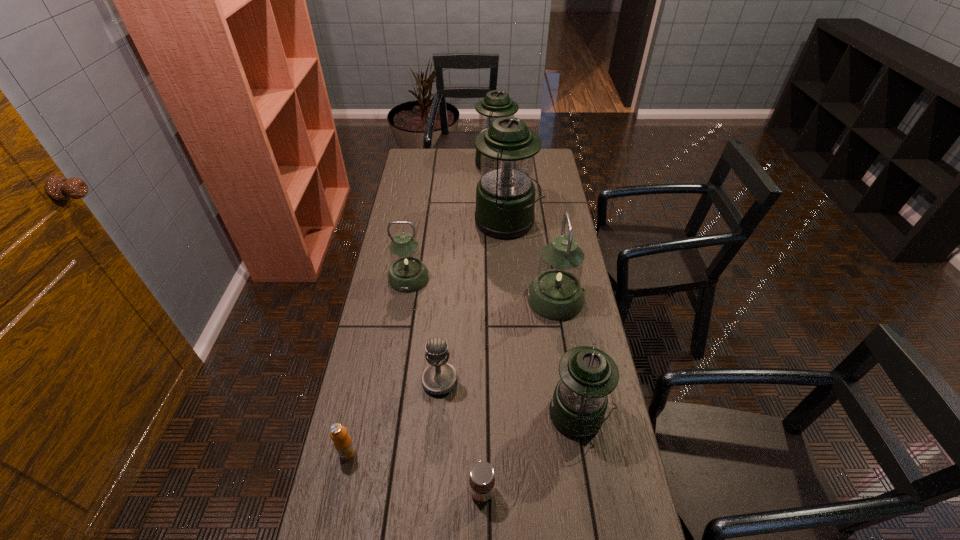
Locate an element on the screen. microphone is located at coordinates (438, 378).

At what (x,y) coordinates should I click in order to perform the action: click on the second shortest object. Please return your answer as a coordinate pair (x, y). Image resolution: width=960 pixels, height=540 pixels. Looking at the image, I should click on (343, 443).

Find the location of `the second nearest object`. the second nearest object is located at coordinates point(343,443).

Where is `the shortest object`? the shortest object is located at coordinates (481, 480).

Image resolution: width=960 pixels, height=540 pixels. I want to click on jam, so click(481, 480).

At what (x,y) coordinates should I click in order to perform the action: click on free space located 0.090m on the left of the tallest object. Please return your answer as a coordinate pair (x, y). Looking at the image, I should click on (454, 222).

Identify the location of vacant region located 0.070m on the right of the farthest object. (534, 165).

The image size is (960, 540). I want to click on vacant area situated 0.140m on the back of the right greenish lantern, so click(x=548, y=254).

This screenshot has height=540, width=960. In order to click on vacant space located 0.090m on the right of the left greenish lantern in this screenshot , I will do `click(453, 278)`.

Identify the location of free location located 0.190m on the left of the smallest green lantern. The width and height of the screenshot is (960, 540). (483, 416).